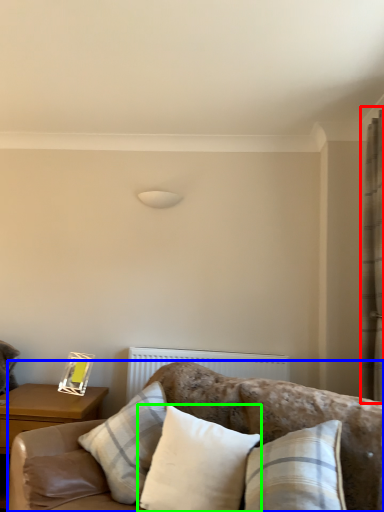
Question: Which object is the closest to the curtain (highlighted by a red box)? Choose among these: studio couch (highlighted by a blue box) or pillow (highlighted by a green box).

Choices:
 (A) studio couch
 (B) pillow

Answer: (A)